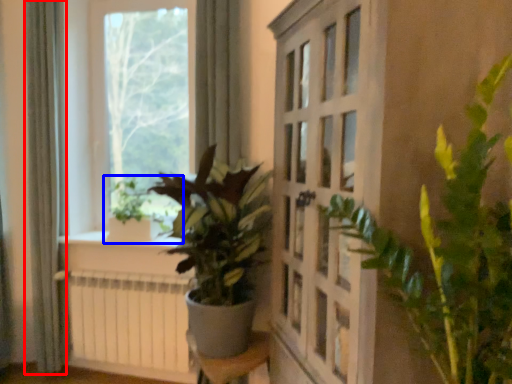
Question: Which point is further to the camera, curtain (highlighted by a red box) or houseplant (highlighted by a blue box)?

Choices:
 (A) curtain
 (B) houseplant

Answer: (B)